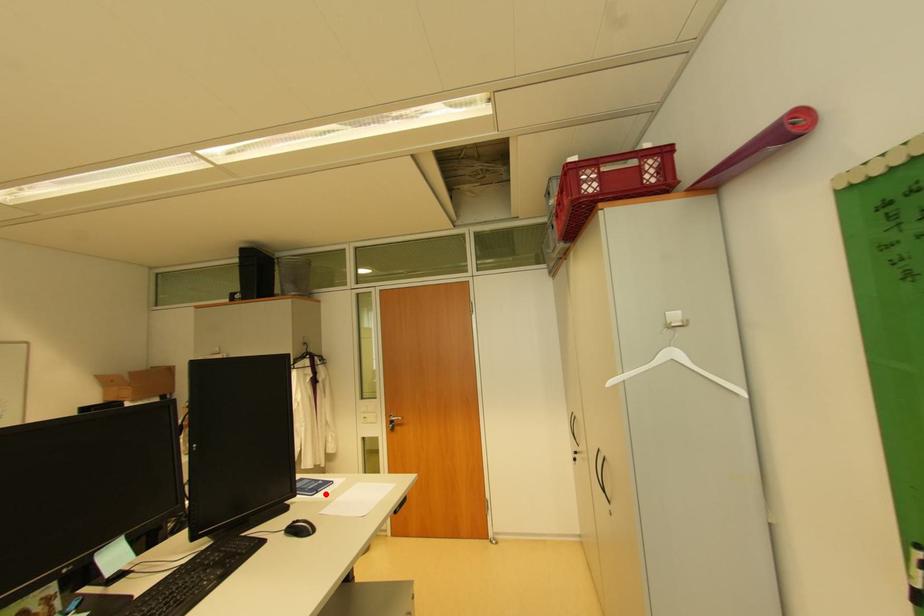
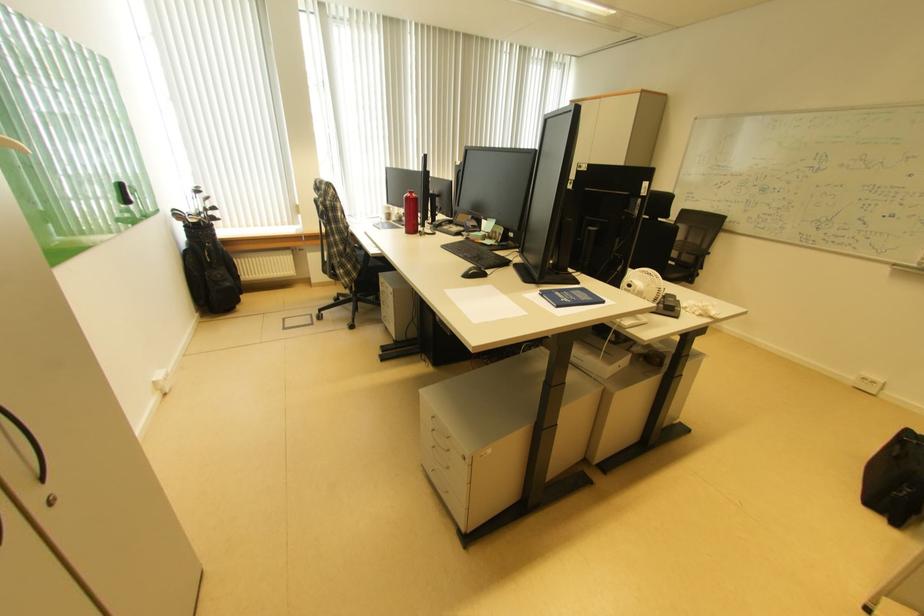
Find the pixel in the second image that matches the highlighted location in the first image.

(551, 297)